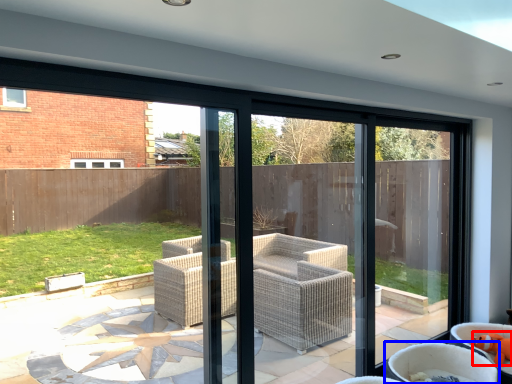
Question: Which of the following is the farthest to the observer, toy (highlighted by a red box) or chair (highlighted by a blue box)?

Choices:
 (A) toy
 (B) chair

Answer: (A)